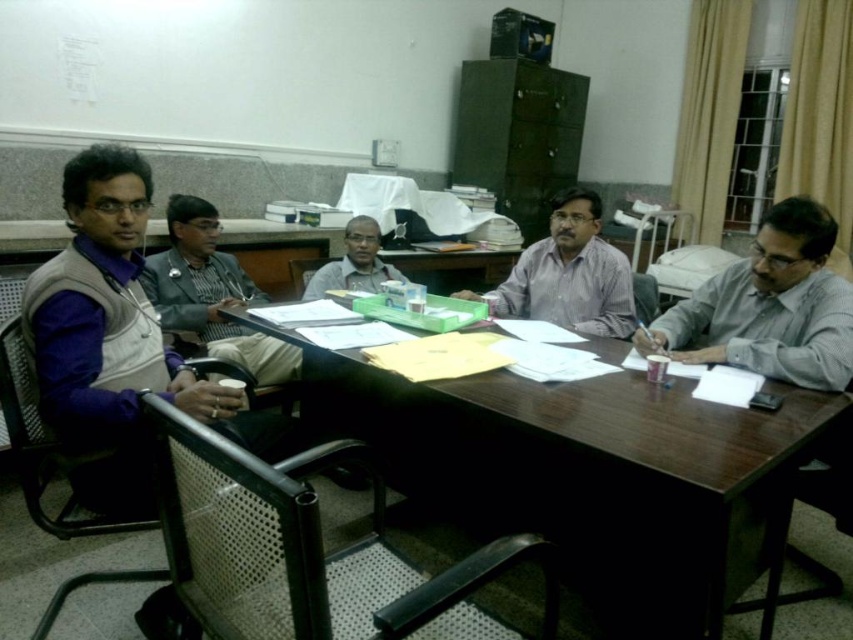
Question: Can you confirm if matte black vest at left is smaller than matte gray sweater at center?

Choices:
 (A) no
 (B) yes

Answer: (A)

Question: From the image, what is the correct spatial relationship of gray matte shirt at right in relation to light purple shirt at center?

Choices:
 (A) right
 (B) left

Answer: (A)

Question: Is light purple shirt at center below matte gray sweater at center?

Choices:
 (A) yes
 (B) no

Answer: (A)

Question: Among these points, which one is farthest from the camera?

Choices:
 (A) (567, 192)
 (B) (345, 232)
 (C) (677, 396)
 (D) (762, 356)

Answer: (B)

Question: Which object appears farthest from the camera in this image?

Choices:
 (A) matte gray sweater at center
 (B) light purple shirt at center

Answer: (A)

Question: Which point is closer to the camera taking this photo?

Choices:
 (A) (717, 284)
 (B) (320, 292)

Answer: (A)